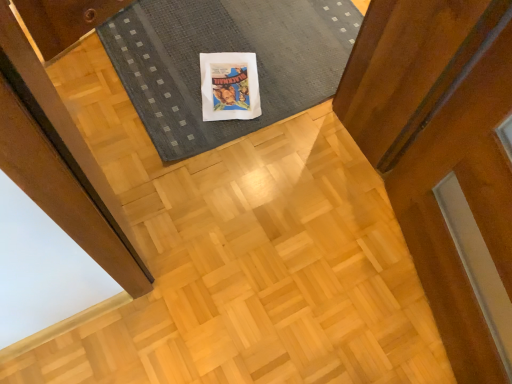
Locate an element on the screen. Image resolution: width=512 pixels, height=384 pixels. free region under dark gray textured mat at center (from a real-world perspective) is located at coordinates (233, 49).